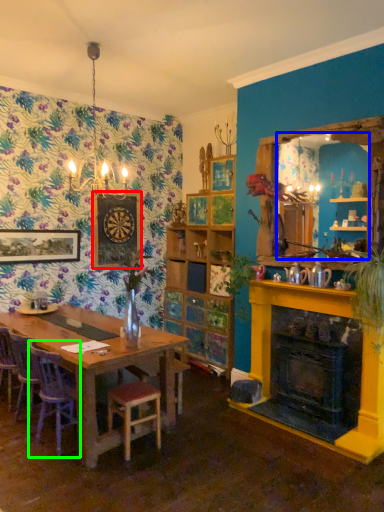
Question: Estimate the real-world distances between objects in this image. Which object is farther from picture frame (highlighted by a red box), mirror (highlighted by a blue box) or chair (highlighted by a green box)?

Choices:
 (A) mirror
 (B) chair

Answer: (A)